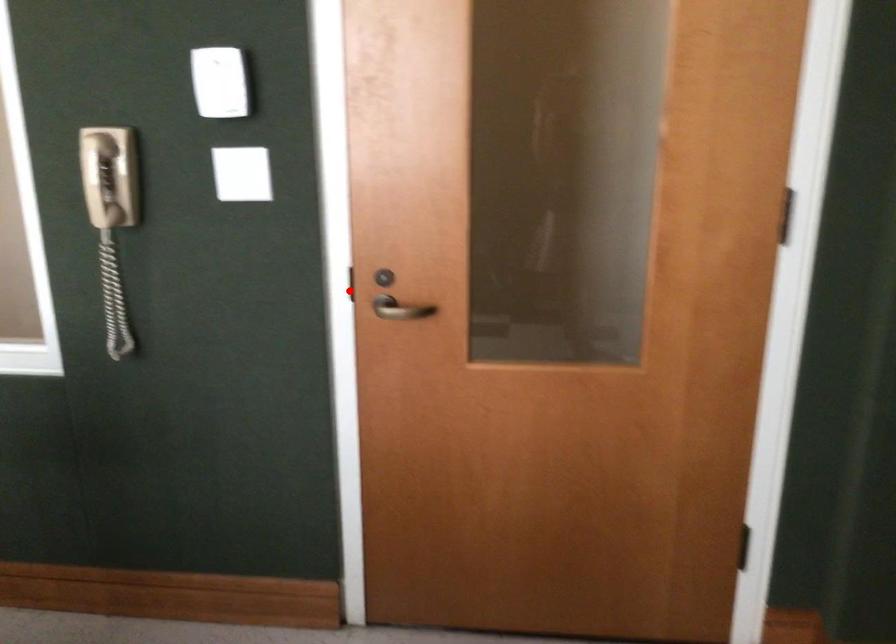
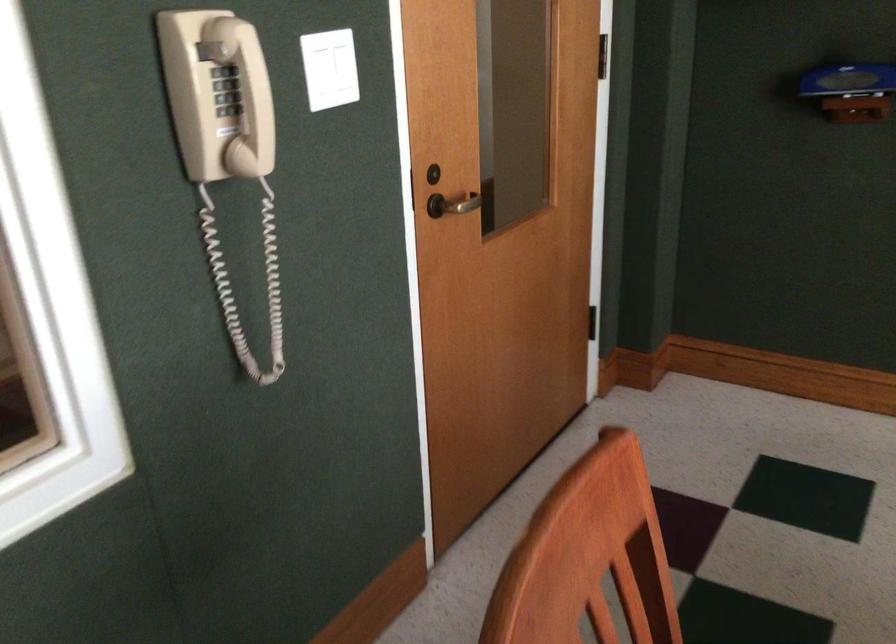
Question: I am providing you with two images of the same scene from different viewpoints. A red point is shown in image1. For the corresponding object point in image2, is it positioned nearer or farther from the camera?

Choices:
 (A) Nearer
 (B) Farther

Answer: (A)